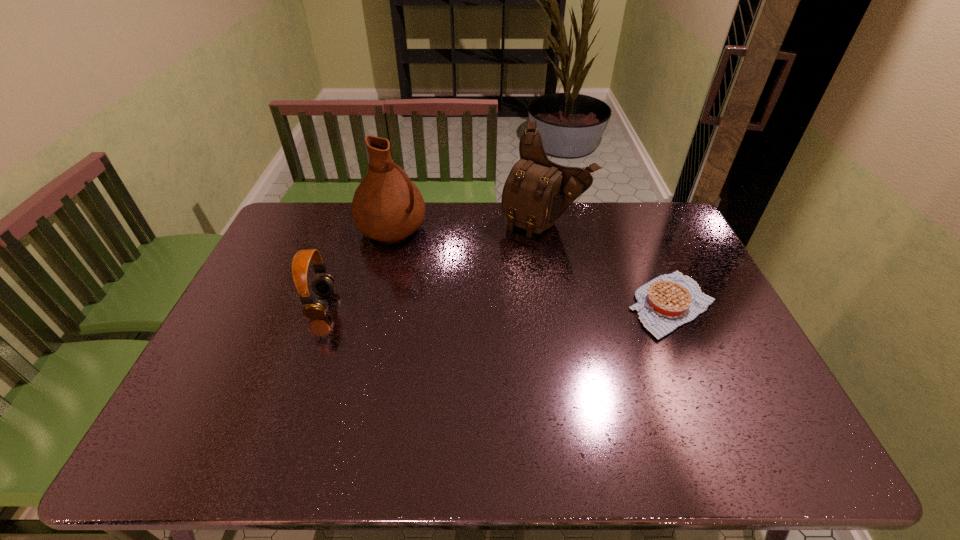
Locate an element on the screen. The image size is (960, 540). empty location between the second shortest object and the shortest object is located at coordinates (497, 305).

This screenshot has height=540, width=960. What are the coordinates of `free area in between the pitcher and the second shortest object` in the screenshot? It's located at (357, 267).

The height and width of the screenshot is (540, 960). In order to click on empty location between the pitcher and the shoulder bag in this screenshot , I will do `click(468, 225)`.

Where is `object identified as the third closest to the shortest object`? The image size is (960, 540). object identified as the third closest to the shortest object is located at coordinates (323, 285).

Identify the location of object that stands as the closest to the second object from right to left. [668, 301].